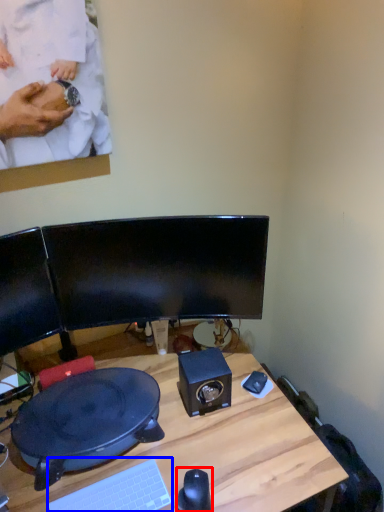
Question: Which object appears farthest to the camera in this image, mouse (highlighted by a red box) or computer keyboard (highlighted by a blue box)?

Choices:
 (A) mouse
 (B) computer keyboard

Answer: (A)